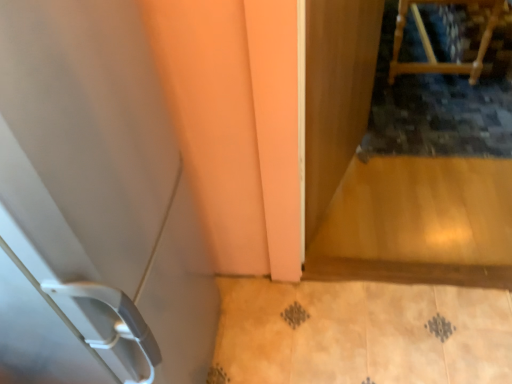
Question: Is white plastic door at left located within wooden chair at upper right?

Choices:
 (A) no
 (B) yes

Answer: (A)

Question: Considering the relative sizes of wooden chair at upper right and white plastic door at left in the image provided, is wooden chair at upper right bigger than white plastic door at left?

Choices:
 (A) yes
 (B) no

Answer: (B)

Question: Is wooden chair at upper right positioned with its back to white plastic door at left?

Choices:
 (A) no
 (B) yes

Answer: (A)

Question: Considering the relative positions of wooden chair at upper right and white plastic door at left in the image provided, is wooden chair at upper right to the left of white plastic door at left from the viewer's perspective?

Choices:
 (A) no
 (B) yes

Answer: (A)

Question: From the image's perspective, does wooden chair at upper right appear higher than white plastic door at left?

Choices:
 (A) yes
 (B) no

Answer: (A)

Question: From a real-world perspective, is wooden chair at upper right below white plastic door at left?

Choices:
 (A) no
 (B) yes

Answer: (B)

Question: Is white plastic door at left touching wooden chair at upper right?

Choices:
 (A) no
 (B) yes

Answer: (A)

Question: From a real-world perspective, is white plastic door at left positioned under wooden chair at upper right based on gravity?

Choices:
 (A) yes
 (B) no

Answer: (B)

Question: Considering the relative sizes of white plastic door at left and wooden chair at upper right in the image provided, is white plastic door at left bigger than wooden chair at upper right?

Choices:
 (A) yes
 (B) no

Answer: (A)

Question: Can you confirm if white plastic door at left is thinner than wooden chair at upper right?

Choices:
 (A) no
 (B) yes

Answer: (A)

Question: Is white plastic door at left oriented away from wooden chair at upper right?

Choices:
 (A) no
 (B) yes

Answer: (A)

Question: Considering the relative sizes of white plastic door at left and wooden chair at upper right in the image provided, is white plastic door at left wider than wooden chair at upper right?

Choices:
 (A) yes
 (B) no

Answer: (A)

Question: Does wooden chair at upper right have a smaller size compared to transparent wooden screen door at upper right?

Choices:
 (A) yes
 (B) no

Answer: (B)